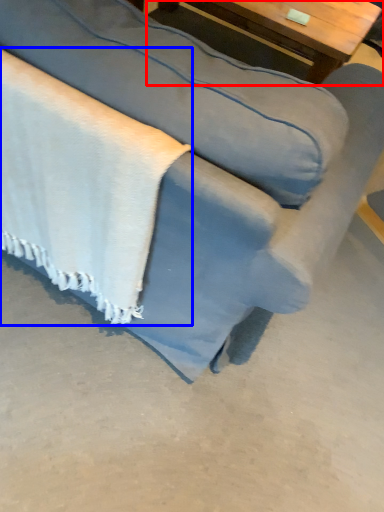
Question: Which object appears closest to the camera in this image, table (highlighted by a red box) or blanket (highlighted by a blue box)?

Choices:
 (A) table
 (B) blanket

Answer: (B)